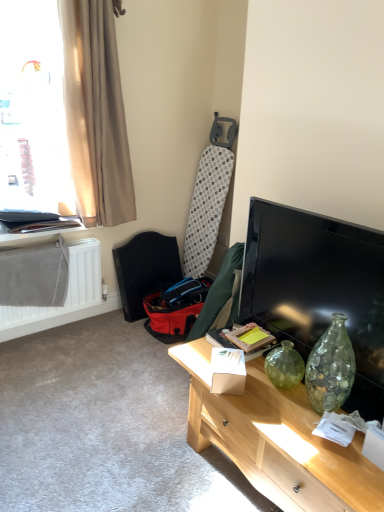
I want to click on empty space that is ontop of white matte radiator at lower left (from a real-world perspective), so point(40,243).